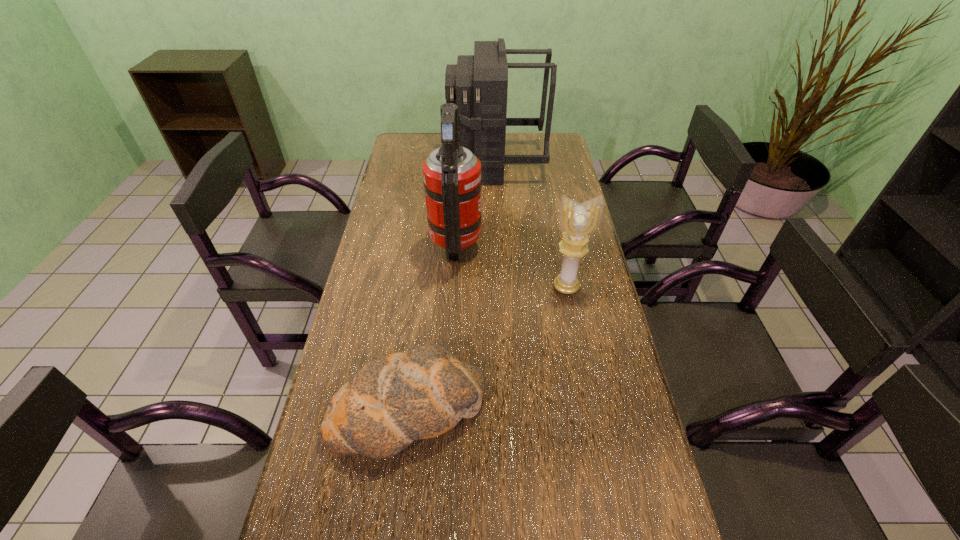
Find the location of a particular element. Image resolution: width=960 pixels, height=540 pixels. fire extinguisher is located at coordinates (452, 174).

Where is `backpack`? This screenshot has width=960, height=540. backpack is located at coordinates (478, 84).

This screenshot has height=540, width=960. What are the coordinates of `award` in the screenshot? It's located at (578, 221).

Image resolution: width=960 pixels, height=540 pixels. What are the coordinates of `the third tallest object` in the screenshot? It's located at (578, 221).

The width and height of the screenshot is (960, 540). In order to click on the shortest object in this screenshot , I will do `click(393, 399)`.

You are a GUI agent. You are given a task and a screenshot of the screen. Output one action in this format:
    pyautogui.click(x=<x>, y=<y>)
    Task: Click on the nearest object
    
    Given the screenshot: What is the action you would take?
    pyautogui.click(x=393, y=399)

The image size is (960, 540). I want to click on vacant region located on the front label side of the second farthest object, so click(515, 244).

Image resolution: width=960 pixels, height=540 pixels. I want to click on vacant region located on the front compartment of the backpack, so click(x=418, y=164).

You are a GUI agent. You are given a task and a screenshot of the screen. Output one action in this format:
    pyautogui.click(x=<x>, y=<y>)
    Task: Click on the vacant space located 0.120m on the front compartment of the backpack
    
    Given the screenshot: What is the action you would take?
    pyautogui.click(x=420, y=164)

Locate an element on the screen. This screenshot has height=540, width=960. blank space located 0.120m on the front compartment of the backpack is located at coordinates (420, 164).